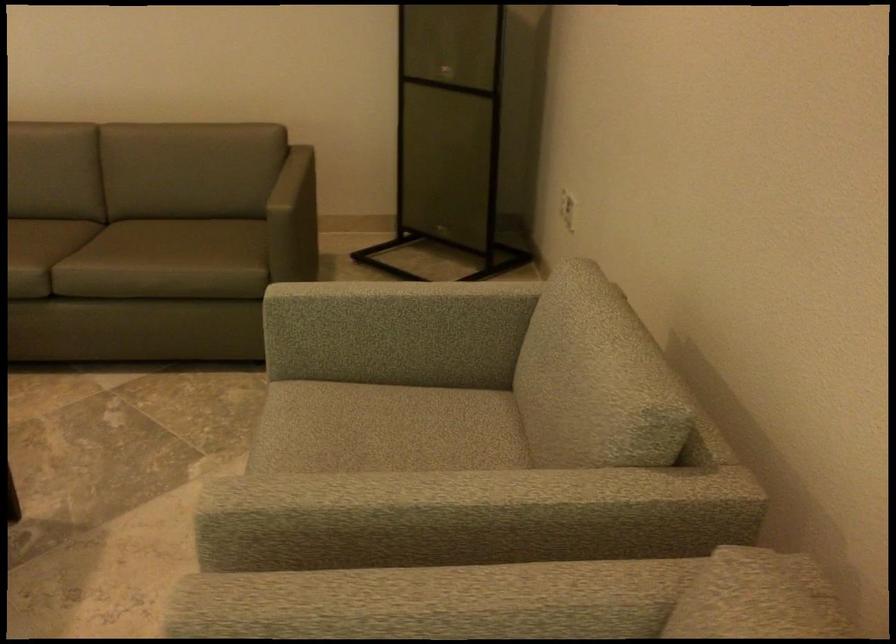
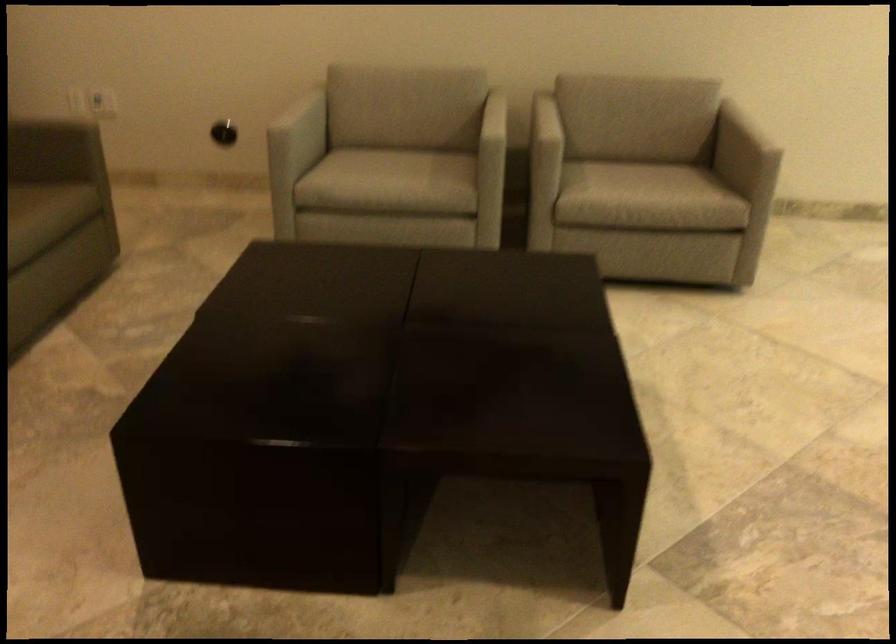
Locate, in the second image, the point that corresponds to (x=471, y=344) in the first image.

(304, 124)